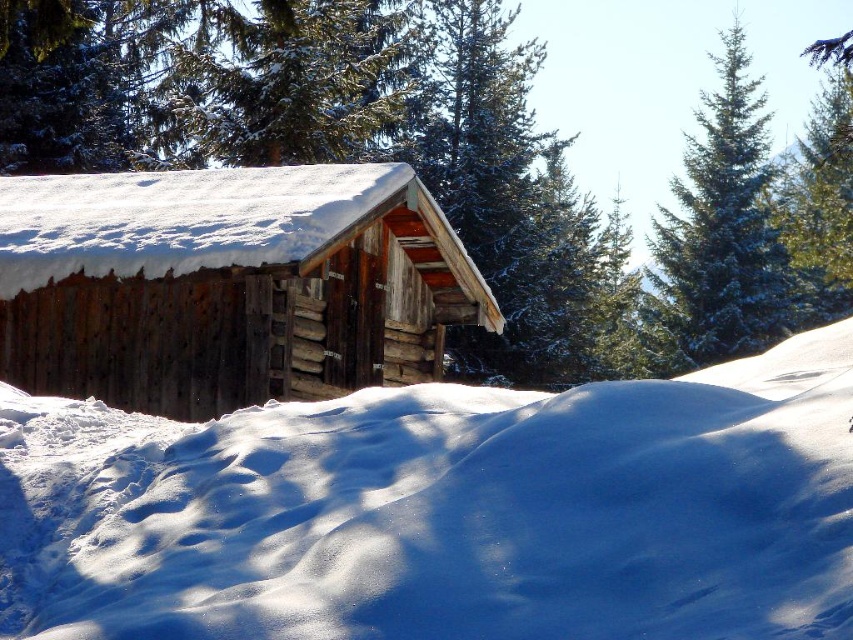
You are standing in the snowy forest and see the green textured pine tree at upper center and the rustic wood log cabin at center. Which object is positioned higher in the image?

The green textured pine tree at upper center is positioned higher than the rustic wood log cabin at center in the image.